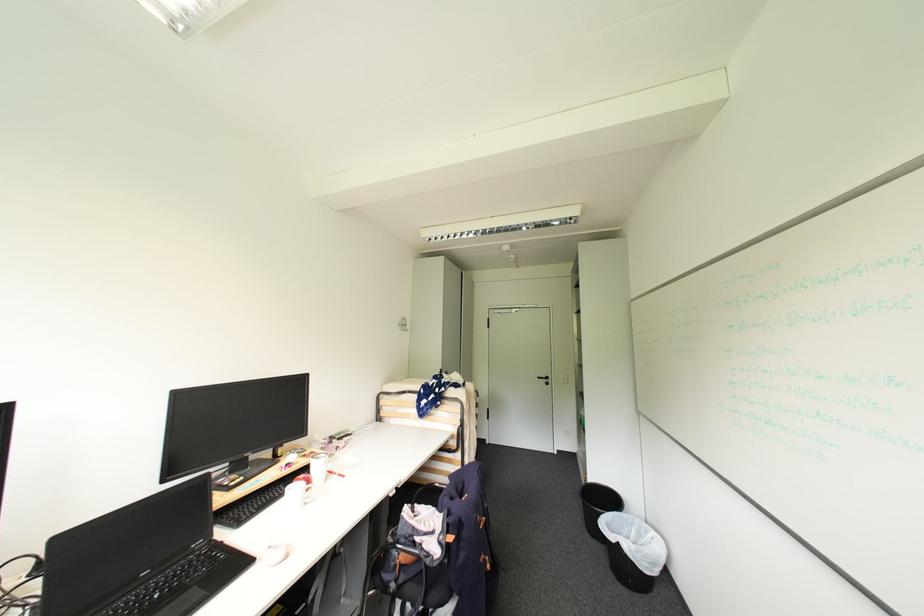
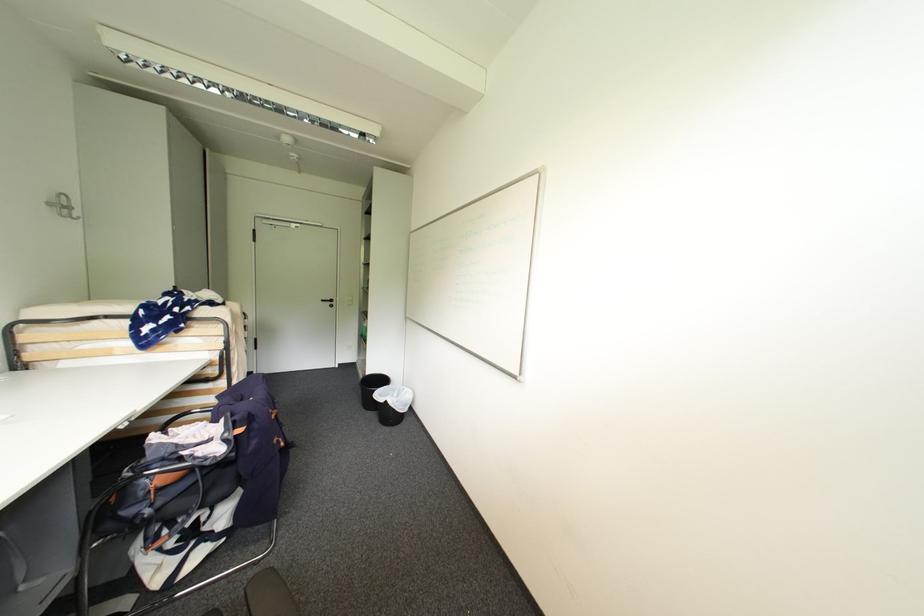
Question: The camera is either moving clockwise (left) or counter-clockwise (right) around the object. The first image is from the beginning of the video and the second image is from the end. Is the camera moving left or right when shooting the video?

Choices:
 (A) Left
 (B) Right

Answer: (A)